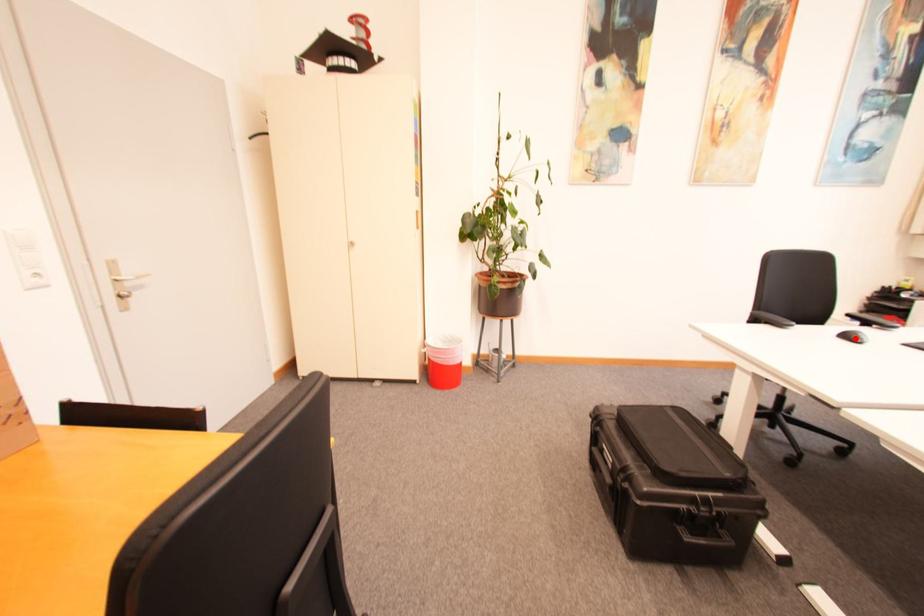
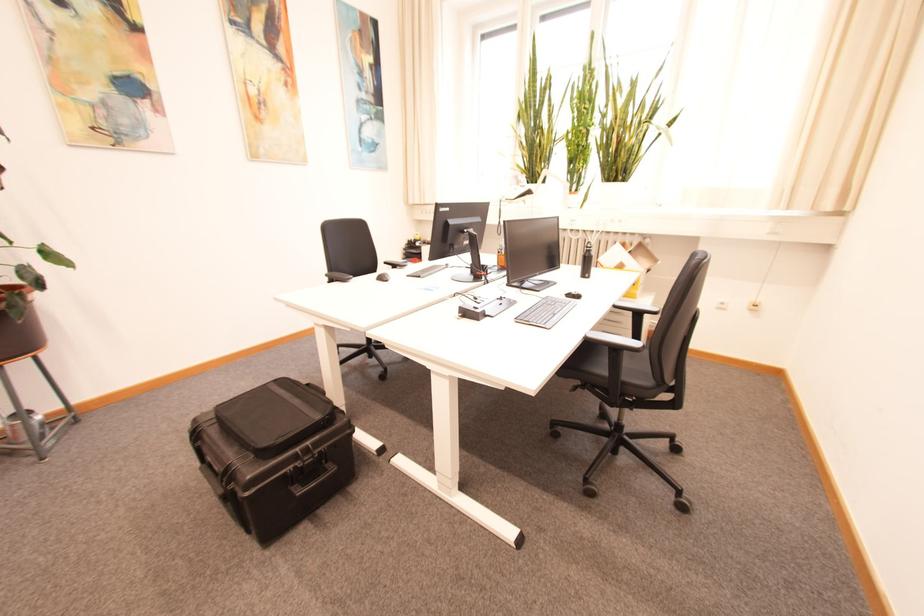
Question: I am providing you with two images of the same scene from different viewpoints. A red point is marked on the first image. At the location where the point appears in image 1, is it still visible in image 2?

Choices:
 (A) Yes
 (B) No

Answer: (A)